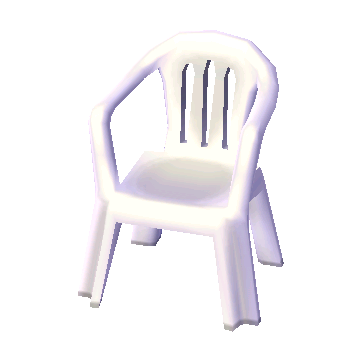
Identify the location of chair. (227, 169).